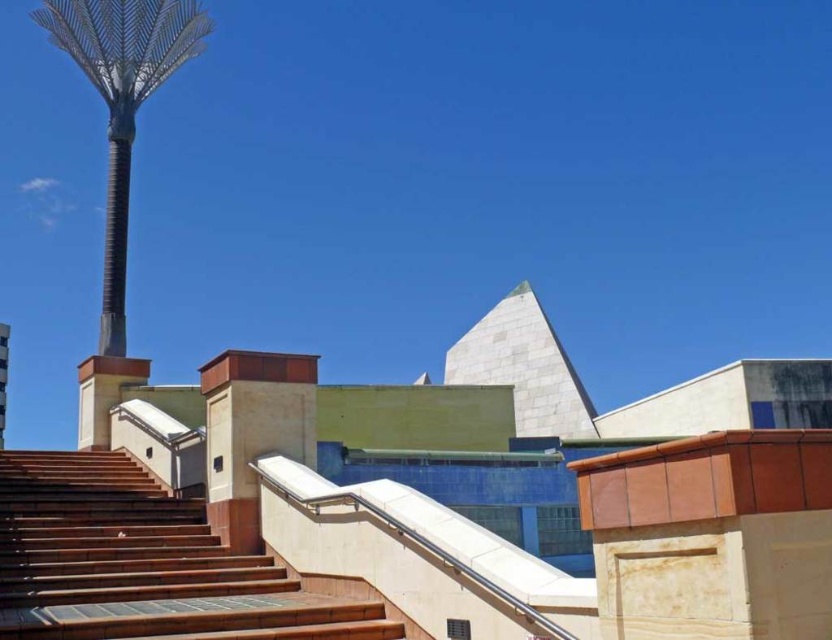
Question: Among these points, which one is nearest to the camera?

Choices:
 (A) (196, 627)
 (B) (109, 163)
 (C) (481, 339)

Answer: (A)

Question: Does white marble pyramid at upper center appear over brown metallic pole at upper left?

Choices:
 (A) yes
 (B) no

Answer: (B)

Question: Does white marble pyramid at upper center have a lesser width compared to brown metallic pole at upper left?

Choices:
 (A) no
 (B) yes

Answer: (A)

Question: Estimate the real-world distances between objects in this image. Which object is closer to the white marble pyramid at upper center?

Choices:
 (A) wooden stairs at lower left
 (B) brown metallic pole at upper left

Answer: (B)

Question: Does white marble pyramid at upper center appear on the right side of brown metallic pole at upper left?

Choices:
 (A) yes
 (B) no

Answer: (A)

Question: Which object is the closest to the wooden stairs at lower left?

Choices:
 (A) white marble pyramid at upper center
 (B) brown metallic pole at upper left

Answer: (B)